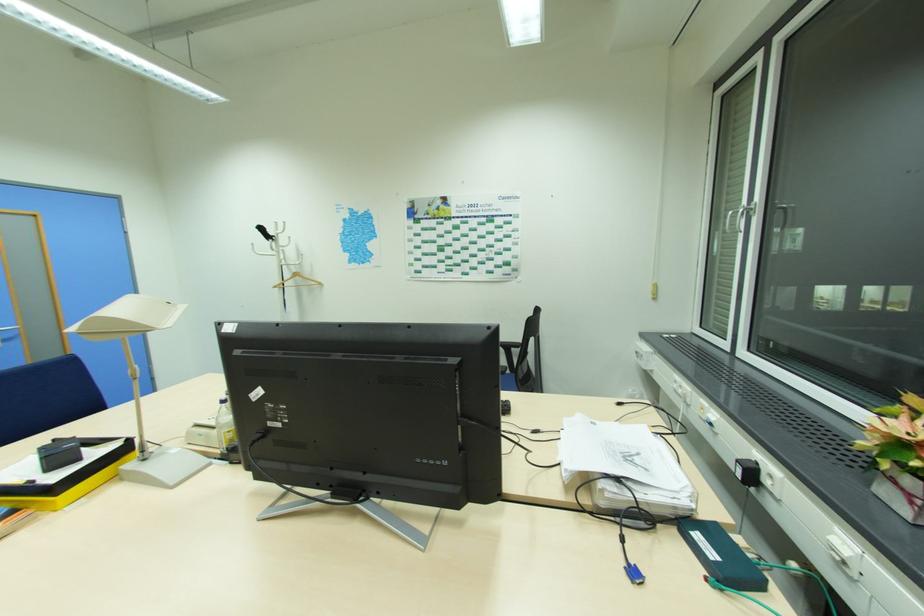
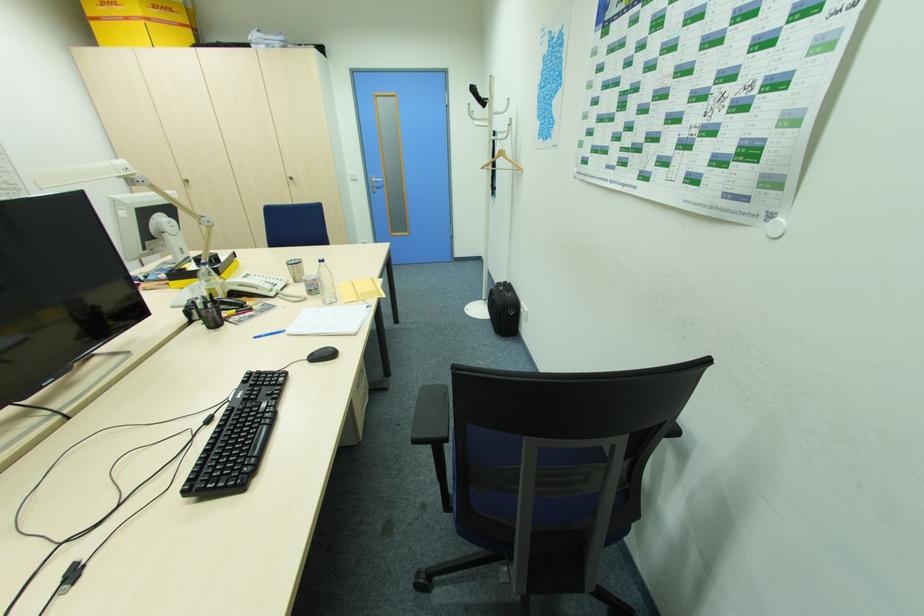
Locate, in the second image, the point that corresponds to point (277, 286) in the first image.

(485, 168)